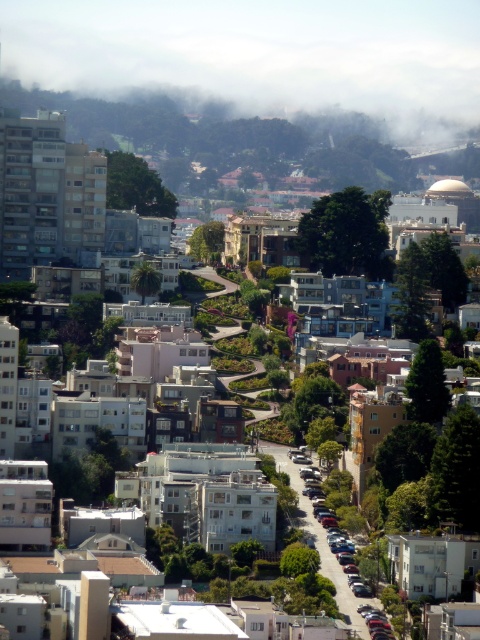
Question: Is foggy cloud at upper center positioned at the back of metallic silver car at center-right?

Choices:
 (A) no
 (B) yes

Answer: (B)

Question: Which point is farther to the camera?

Choices:
 (A) (466, 4)
 (B) (300, 492)

Answer: (A)

Question: Among these points, which one is nearest to the camera?

Choices:
 (A) pos(314,22)
 (B) pos(324,548)

Answer: (B)

Question: Is the position of foggy cloud at upper center more distant than that of metallic silver car at center-right?

Choices:
 (A) no
 (B) yes

Answer: (B)

Question: Does foggy cloud at upper center have a larger size compared to metallic silver car at center-right?

Choices:
 (A) no
 (B) yes

Answer: (B)

Question: Among these objects, which one is nearest to the camera?

Choices:
 (A) metallic silver car at center-right
 (B) foggy cloud at upper center

Answer: (A)